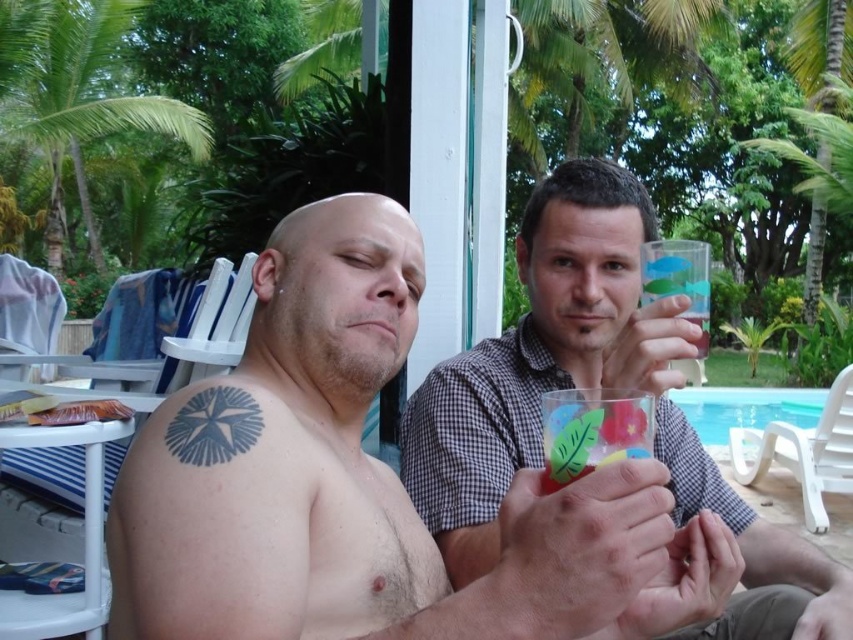
Between shiny metallic cup at center and blue glass at lower center, which one has less height?

Standing shorter between the two is blue glass at lower center.

The height and width of the screenshot is (640, 853). In order to click on shiny metallic cup at center in this screenshot , I will do `click(368, 486)`.

Is point (338, 576) farther from viewer compared to point (714, 404)?

No, (338, 576) is in front of (714, 404).

Where is `shiny metallic cup at center`? The height and width of the screenshot is (640, 853). shiny metallic cup at center is located at coordinates (368, 486).

Does black ink tattoo at upper left appear under white plastic chair at upper left?

Correct, black ink tattoo at upper left is located below white plastic chair at upper left.

Does black ink tattoo at upper left appear on the right side of white plastic chair at upper left?

Indeed, black ink tattoo at upper left is positioned on the right side of white plastic chair at upper left.

Describe the element at coordinates (263, 525) in the screenshot. The width and height of the screenshot is (853, 640). I see `black ink tattoo at upper left` at that location.

Identify the location of black ink tattoo at upper left. (263, 525).

Is white plastic chair at upper left to the left of white plastic chair at lower right from the viewer's perspective?

Indeed, white plastic chair at upper left is positioned on the left side of white plastic chair at lower right.

From the picture: Which is more to the left, white plastic chair at upper left or white plastic chair at lower right?

From the viewer's perspective, white plastic chair at upper left appears more on the left side.

The width and height of the screenshot is (853, 640). Identify the location of white plastic chair at upper left. (213, 324).